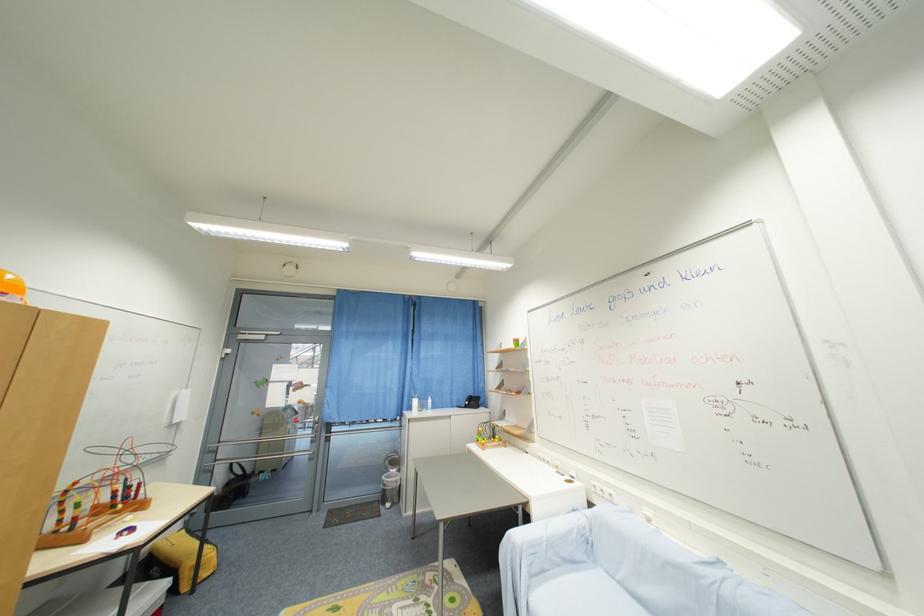
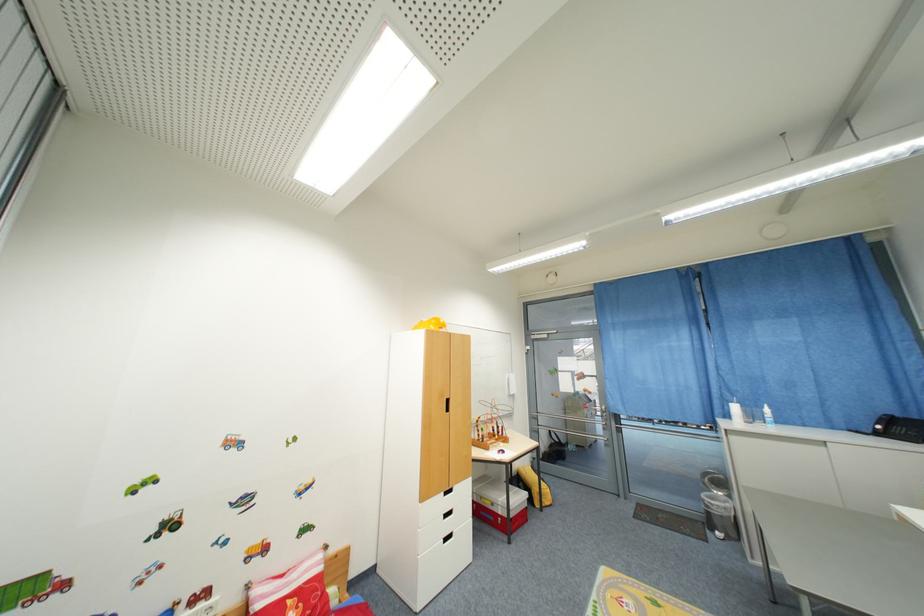
Find the pixel in the second image that matches point (234, 485) in the first image.

(555, 448)